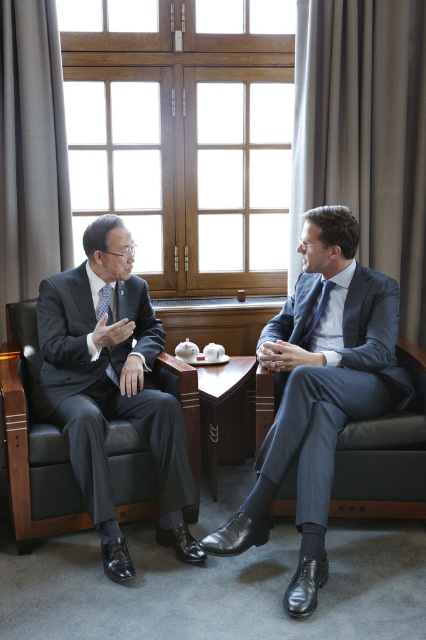
Who is shorter, blue satin suit at center or dark blue fabric armchair at right?

dark blue fabric armchair at right is shorter.

Describe the element at coordinates (319, 392) in the screenshot. I see `blue satin suit at center` at that location.

This screenshot has width=426, height=640. What are the coordinates of `blue satin suit at center` in the screenshot? It's located at (319, 392).

Which of these two, blue satin suit at center or wooden table at center, stands shorter?

Standing shorter between the two is wooden table at center.

Locate an element on the screen. blue satin suit at center is located at coordinates (319, 392).

Does point (314, 497) come in front of point (215, 408)?

Yes, point (314, 497) is in front of point (215, 408).

I want to click on blue satin suit at center, so click(319, 392).

Can you confirm if wooden table at center is bigger than matte blue tie at center?

Yes, wooden table at center is bigger than matte blue tie at center.

Can you confirm if wooden table at center is positioned above matte blue tie at center?

Actually, wooden table at center is below matte blue tie at center.

Is point (249, 404) closer to viewer compared to point (333, 282)?

No.

Find the location of a particular element. wooden table at center is located at coordinates (227, 413).